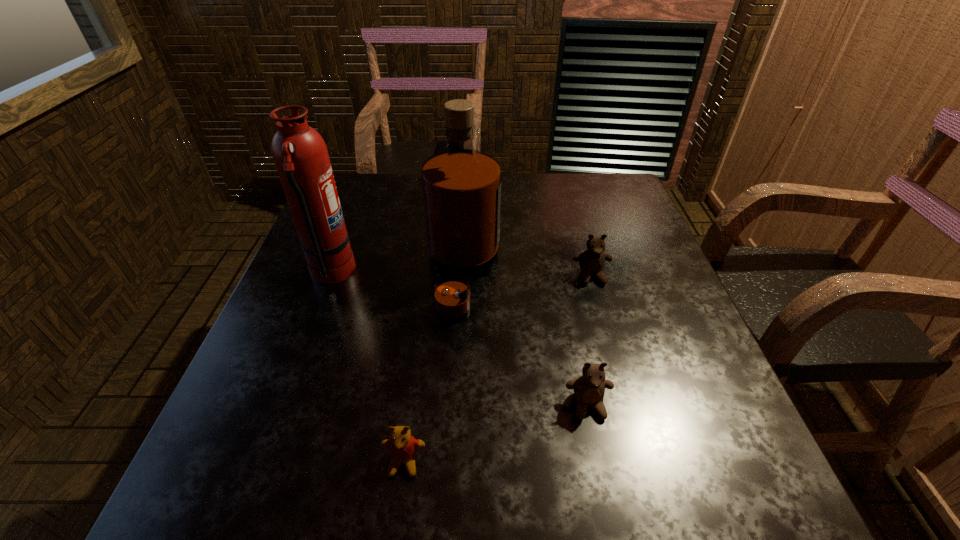
Locate which teddy bear is the second closest to the nearest object. Please provide its 2D coordinates. Your answer should be formatted as a tuple, i.e. [(x, y)], where the tuple contains the x and y coordinates of a point satisfying the conditions above.

[(592, 261)]

The width and height of the screenshot is (960, 540). Find the location of `vacant space that satisfies the following two spatial constraints: 1. on the front label of the liquor; 2. on the front-facing side of the leftmost teddy bear`. vacant space that satisfies the following two spatial constraints: 1. on the front label of the liquor; 2. on the front-facing side of the leftmost teddy bear is located at coordinates pyautogui.click(x=455, y=462).

Locate an element on the screen. Image resolution: width=960 pixels, height=540 pixels. vacant space that satisfies the following two spatial constraints: 1. on the front label of the liquor; 2. on the front-facing side of the shortest object is located at coordinates (455, 462).